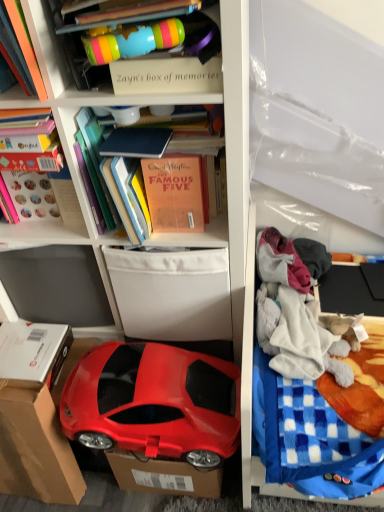
What do you see at coordinates (305, 465) in the screenshot? This screenshot has width=384, height=512. I see `blue checkered blanket at right` at bounding box center [305, 465].

In order to click on white fabric storage box at center in this screenshot , I will do 172,293.

What is the approximate height of white fabric storage box at center?

It is 13.37 inches.

This screenshot has width=384, height=512. Describe the element at coordinates (147, 61) in the screenshot. I see `matte plastic cup at upper center` at that location.

This screenshot has width=384, height=512. What are the coordinates of `orange matte book at upper center, which is the third book in left-to-right order` in the screenshot? It's located at (116, 179).

Locate an element on the screen. This screenshot has height=512, width=384. hardcover book at upper left, the third book in the right-to-left sequence is located at coordinates [32, 160].

Find the location of a particular element. blue checkered blanket at right is located at coordinates (305, 465).

Can you confirm if hardcover book at upper left, the third book in the right-to-left sequence, is wider than fluffy cotton blanket at right, placed as the first clothing when sorted from bottom to top?

Yes, hardcover book at upper left, the third book in the right-to-left sequence, is wider than fluffy cotton blanket at right, placed as the first clothing when sorted from bottom to top.

Is hardcover book at upper left, the third book in the right-to-left sequence, oriented towards fluffy cotton blanket at right, placed as the first clothing when sorted from bottom to top?

No.

From the image's perspective, is hardcover book at upper left, the third book in the right-to-left sequence, on fluffy cotton blanket at right, placed as the first clothing when sorted from bottom to top?

Correct, hardcover book at upper left, the third book in the right-to-left sequence, appears higher than fluffy cotton blanket at right, placed as the first clothing when sorted from bottom to top, in the image.

Find the location of a particular element. The image size is (384, 512). book that is the 2nd object above the fluffy cotton blanket at right, placed as the first clothing when sorted from bottom to top (from a real-world perspective) is located at coordinates (32, 160).

From the image's perspective, relative to hardcover book at upper left, the 1th book from the left, is gray fleece blanket at right, which is the 2th clothing in bottom-to-top order, above or below?

Based on their image positions, gray fleece blanket at right, which is the 2th clothing in bottom-to-top order, is located beneath hardcover book at upper left, the 1th book from the left.

Is gray fleece blanket at right, the first clothing when ordered from top to bottom, in front of hardcover book at upper left, the 1th book from the left?

No.

Is point (277, 261) closer or farther from the camera than point (81, 221)?

Point (277, 261) is positioned farther from the camera compared to point (81, 221).

What's the angular difference between gray fleece blanket at right, which is the 2th clothing in bottom-to-top order, and hardcover book at upper left, the third book in the right-to-left sequence,'s facing directions?

87.9 degrees.

Is cardboard at lower left to the right of gray fleece blanket at right, which is the 2th clothing in bottom-to-top order, from the viewer's perspective?

In fact, cardboard at lower left is to the left of gray fleece blanket at right, which is the 2th clothing in bottom-to-top order.

Is cardboard at lower left situated inside gray fleece blanket at right, which is the 2th clothing in bottom-to-top order, or outside?

The correct answer is: outside.

Is point (21, 431) in front of point (258, 256)?

Yes, point (21, 431) is in front of point (258, 256).

Could you tell me if cardboard at lower left is facing gray fleece blanket at right, the first clothing when ordered from top to bottom?

No, cardboard at lower left is not facing towards gray fleece blanket at right, the first clothing when ordered from top to bottom.

Locate an element on the screen. The image size is (384, 512). car located underneath the hardcover book at upper left, the 1th book from the left (from a real-world perspective) is located at coordinates (154, 402).

From a real-world perspective, who is located higher, hardcover book at upper left, the third book in the right-to-left sequence, or shiny red car at lower left?

From a 3D spatial view, hardcover book at upper left, the third book in the right-to-left sequence, is above.

Which is closer to the camera, (29, 160) or (134, 446)?

Point (29, 160) appears to be closer to the viewer than point (134, 446).

Considering the relative positions of hardcover book at upper left, the 1th book from the left, and shiny red car at lower left in the image provided, is hardcover book at upper left, the 1th book from the left, to the right of shiny red car at lower left from the viewer's perspective?

In fact, hardcover book at upper left, the 1th book from the left, is to the left of shiny red car at lower left.

Is white fabric storage box at center not near matte plastic cup at upper center?

white fabric storage box at center is actually quite close to matte plastic cup at upper center.

Between white fabric storage box at center and matte plastic cup at upper center, which one has smaller size?

Smaller between the two is matte plastic cup at upper center.

Does point (192, 325) come closer to viewer compared to point (207, 57)?

No.

Is white fabric storage box at center facing away from matte plastic cup at upper center?

No, white fabric storage box at center's orientation is not away from matte plastic cup at upper center.

Based on the photo, measure the distance between matte plastic toy car at lower left and cardboard at lower left.

matte plastic toy car at lower left and cardboard at lower left are 39.15 centimeters apart.

Does matte plastic toy car at lower left appear on the left side of cardboard at lower left?

Incorrect, matte plastic toy car at lower left is not on the left side of cardboard at lower left.

From a real-world perspective, is matte plastic toy car at lower left physically below cardboard at lower left?

Incorrect, from a real-world perspective, matte plastic toy car at lower left is higher than cardboard at lower left.

In the scene shown: From the image's perspective, which object appears higher, matte plastic toy car at lower left or cardboard at lower left?

matte plastic toy car at lower left, from the image's perspective.

Is matte orange book at upper left, positioned as the 2th book in left-to-right order, situated inside blue checkered blanket at right or outside?

matte orange book at upper left, positioned as the 2th book in left-to-right order, lies outside blue checkered blanket at right.

How different are the orientations of matte orange book at upper left, which is the 2th book in right-to-left order, and blue checkered blanket at right in degrees?

The angular difference between matte orange book at upper left, which is the 2th book in right-to-left order, and blue checkered blanket at right is 0.308 degrees.

Where is `infant bed that is under the matte orange book at upper left, which is the 2th book in right-to-left order (from a real-world perspective)`? Image resolution: width=384 pixels, height=512 pixels. infant bed that is under the matte orange book at upper left, which is the 2th book in right-to-left order (from a real-world perspective) is located at coordinates (305, 465).

Considering the sizes of objects matte orange book at upper left, which is the 2th book in right-to-left order, and blue checkered blanket at right in the image provided, who is wider, matte orange book at upper left, which is the 2th book in right-to-left order, or blue checkered blanket at right?

blue checkered blanket at right.

This screenshot has width=384, height=512. Find the location of `clothing that is the 2nd object directly below the hardcover book at upper left, the 1th book from the left (from a real-world perspective)`. clothing that is the 2nd object directly below the hardcover book at upper left, the 1th book from the left (from a real-world perspective) is located at coordinates (293, 315).

Locate an element on the screen. The height and width of the screenshot is (512, 384). the 1st book positioned above the gray fleece blanket at right, the first clothing when ordered from top to bottom (from the image's perspective) is located at coordinates (32, 160).

When comparing their distances from hardcover book at upper left, the third book in the right-to-left sequence, does orange matte book at upper center, acting as the first book starting from the right, or cardboard at lower left seem further?

cardboard at lower left is positioned further to the anchor hardcover book at upper left, the third book in the right-to-left sequence.

Considering their positions, is white fabric storage box at center positioned further to matte plastic cup at upper center than cardboard at lower left?

cardboard at lower left is positioned further to the anchor matte plastic cup at upper center.

When comparing their distances from orange matte book at upper center, which is the third book in left-to-right order, does cardboard at lower left or matte plastic cup at upper center seem further?

Based on the image, cardboard at lower left appears to be further to orange matte book at upper center, which is the third book in left-to-right order.

Based on their spatial positions, is orange matte book at upper center, acting as the first book starting from the right, or shiny red car at lower left further from fluffy cotton blanket at right, which is the 2th clothing in top-to-bottom order?

orange matte book at upper center, acting as the first book starting from the right, is positioned further to the anchor fluffy cotton blanket at right, which is the 2th clothing in top-to-bottom order.

Based on their spatial positions, is fluffy cotton blanket at right, placed as the first clothing when sorted from bottom to top, or orange matte book at upper center, which is the third book in left-to-right order, closer to white fabric storage box at center?

Based on the image, orange matte book at upper center, which is the third book in left-to-right order, appears to be nearer to white fabric storage box at center.

Based on their spatial positions, is fluffy cotton blanket at right, which is the 2th clothing in top-to-bottom order, or white fabric storage box at center closer to shiny red car at lower left?

Among the two, white fabric storage box at center is located nearer to shiny red car at lower left.

Based on their spatial positions, is white fabric storage box at center or matte plastic cup at upper center closer to gray fleece blanket at right, which is the 2th clothing in bottom-to-top order?

Among the two, white fabric storage box at center is located nearer to gray fleece blanket at right, which is the 2th clothing in bottom-to-top order.

Considering their positions, is blue checkered blanket at right positioned closer to cardboard at lower left than white fabric storage box at center?

The object closer to cardboard at lower left is white fabric storage box at center.

What are the coordinates of `cabinet between hardcover book at upper left, the third book in the right-to-left sequence, and gray fleece blanket at right, which is the 2th clothing in bottom-to-top order` in the screenshot? It's located at (147, 61).

The height and width of the screenshot is (512, 384). I want to click on storage box between cardboard at lower left and fluffy cotton blanket at right, placed as the first clothing when sorted from bottom to top, so click(x=172, y=293).

Find the location of a particular element. Image resolution: width=384 pixels, height=512 pixels. shelf located between cardboard at lower left and gray fleece blanket at right, which is the 2th clothing in bottom-to-top order, in the left-right direction is located at coordinates (154, 233).

Image resolution: width=384 pixels, height=512 pixels. Identify the location of storage box between matte plastic cup at upper center and shiny red car at lower left in the vertical direction. (172, 293).